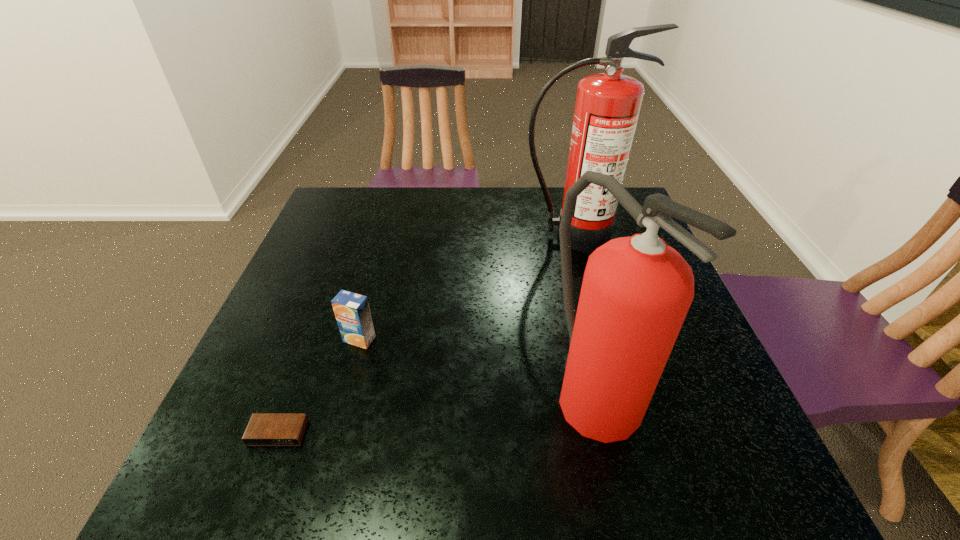
Identify the location of the farthest object. This screenshot has width=960, height=540. (607, 107).

I want to click on the nearer fire extinguisher, so click(x=636, y=292).

This screenshot has height=540, width=960. I want to click on the second tallest object, so click(636, 292).

Where is `the second shortest object`? the second shortest object is located at coordinates (352, 312).

The image size is (960, 540). Identify the location of the third object from right to left. point(352,312).

The height and width of the screenshot is (540, 960). In order to click on the shortest object in this screenshot , I will do `click(264, 429)`.

Locate an element on the screen. The width and height of the screenshot is (960, 540). alarm clock is located at coordinates (264, 429).

Identify the location of free point located 0.290m on the front-facing side of the farther fire extinguisher. (598, 333).

Image resolution: width=960 pixels, height=540 pixels. I want to click on vacant position located 0.050m on the handle side of the third shortest object, so click(615, 482).

At what (x,y) coordinates should I click in order to perform the action: click on vacant area situated 0.300m on the front of the orange_juice. Please return your answer as a coordinate pair (x, y). Looking at the image, I should click on (318, 494).